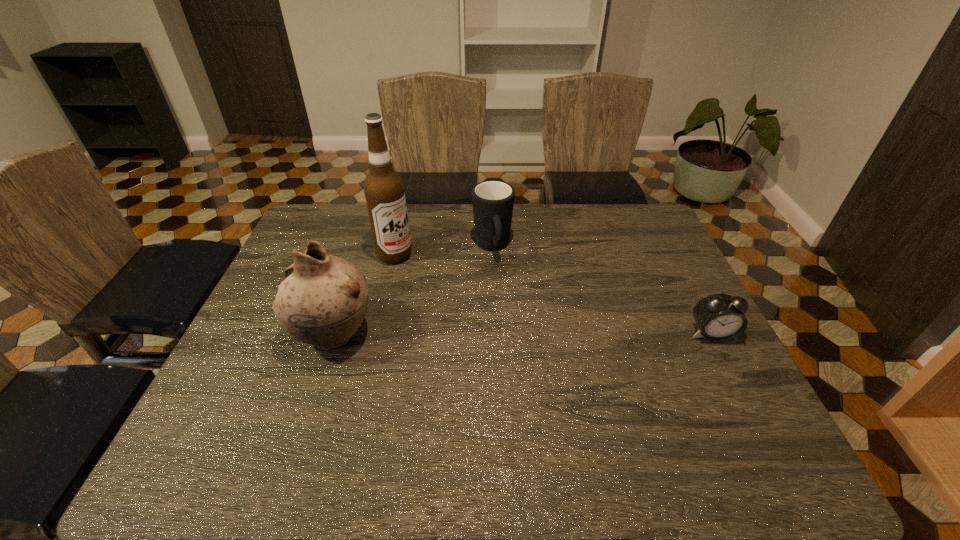
Where is `vacant region located 0.200m on the label of the tallest object`? This screenshot has width=960, height=540. vacant region located 0.200m on the label of the tallest object is located at coordinates (457, 289).

Locate an element on the screen. vacant space located on the side of the third object from left to right with the handle is located at coordinates (504, 298).

Find the location of a particular element. Image resolution: width=960 pixels, height=540 pixels. vacant space located 0.200m on the side of the third object from left to right with the handle is located at coordinates (508, 313).

You are a GUI agent. You are given a task and a screenshot of the screen. Output one action in this format:
    pyautogui.click(x=<x>, y=<y>)
    Task: Click on the blank area located on the side of the third object from left to right with the handle
    The image size is (960, 540).
    Given the screenshot: What is the action you would take?
    pyautogui.click(x=506, y=305)

This screenshot has width=960, height=540. What are the coordinates of `object positioned at the far edge` in the screenshot? It's located at (493, 201).

This screenshot has height=540, width=960. I want to click on object present at the left edge, so click(x=322, y=300).

Locate an element on the screen. object that is at the right edge is located at coordinates (720, 317).

In the image, there is a desktop. What are the coordinates of `vacant space at the far edge` in the screenshot? It's located at (357, 217).

At what (x,y) coordinates should I click in order to perform the action: click on vacant space at the near edge of the desktop. Please return your answer as a coordinate pair (x, y). The width and height of the screenshot is (960, 540). Looking at the image, I should click on (466, 406).

This screenshot has height=540, width=960. In order to click on free space at the left edge of the desktop in this screenshot , I will do `click(265, 306)`.